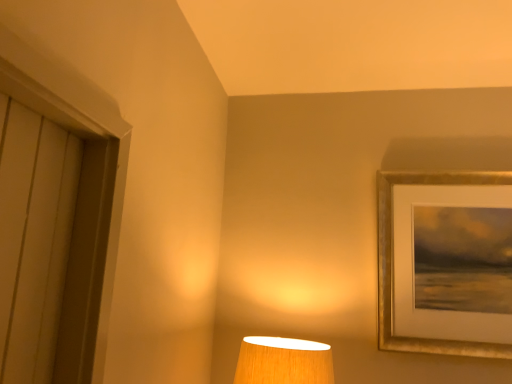
Find the location of a particular element. The image size is (512, 384). gold-framed picture at upper right is located at coordinates (391, 264).

This screenshot has width=512, height=384. Describe the element at coordinates (391, 264) in the screenshot. I see `gold-framed picture at upper right` at that location.

Where is `gold-framed picture at upper right`? This screenshot has height=384, width=512. gold-framed picture at upper right is located at coordinates (391, 264).